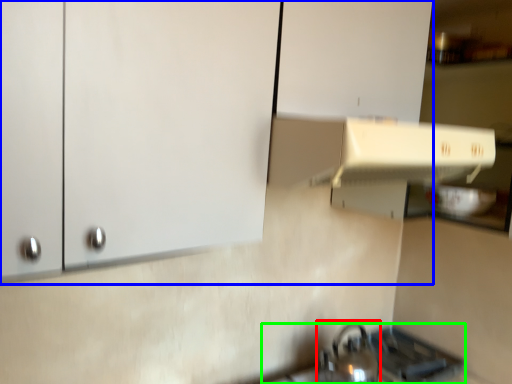
Question: Which is farther away from tea pot (highlighted by a red box)? cabinetry (highlighted by a blue box) or gas stove (highlighted by a green box)?

Choices:
 (A) cabinetry
 (B) gas stove

Answer: (A)